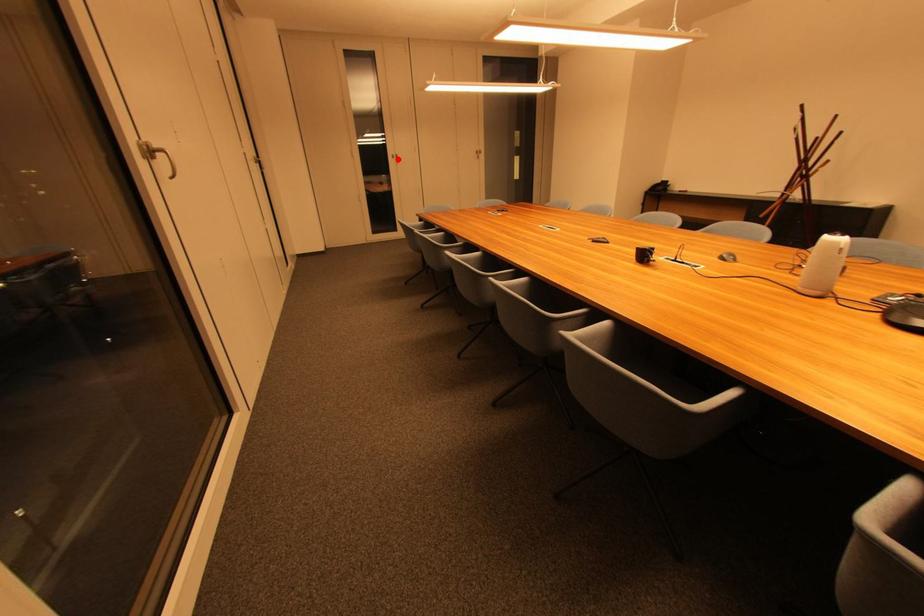
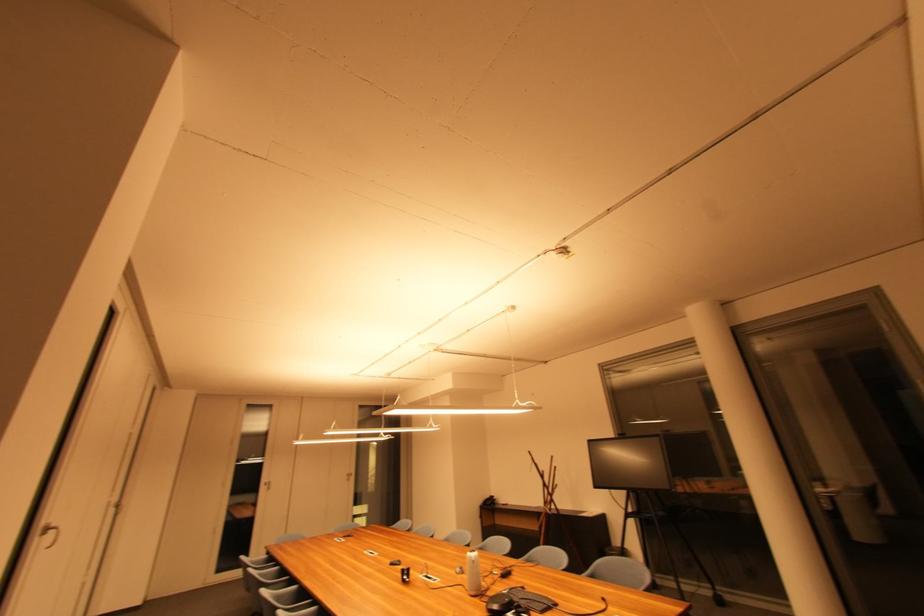
Question: I am providing you with two images of the same scene from different viewpoints. A red point is shown in image1. For the corresponding object point in image2, is it positioned nearer or farther from the camera?

Choices:
 (A) Nearer
 (B) Farther

Answer: (B)